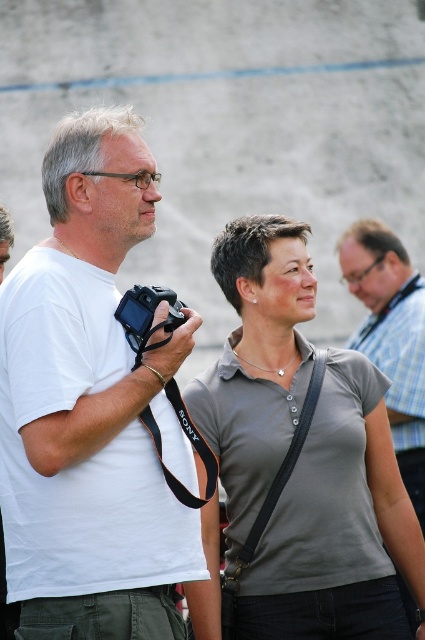
Is the position of plaid fabric shirt at center less distant than that of black plastic camera at left?

No, it is behind black plastic camera at left.

Can you confirm if plaid fabric shirt at center is positioned to the right of black plastic camera at left?

Yes, plaid fabric shirt at center is to the right of black plastic camera at left.

Identify the location of plaid fabric shirt at center. (391, 337).

Does white matte camera at left have a greater width compared to plaid fabric shirt at center?

Yes, white matte camera at left is wider than plaid fabric shirt at center.

Can you confirm if white matte camera at left is positioned below plaid fabric shirt at center?

Incorrect, white matte camera at left is not positioned below plaid fabric shirt at center.

Locate an element on the screen. This screenshot has height=640, width=425. white matte camera at left is located at coordinates (90, 408).

Consider the image. Who is shorter, white matte camera at left or black plastic camera at left?

black plastic camera at left

Between point (65, 433) and point (164, 339), which one is positioned behind?

Positioned behind is point (164, 339).

Does point (70, 177) lie in front of point (167, 314)?

No, it is behind (167, 314).

Image resolution: width=425 pixels, height=640 pixels. What are the coordinates of `white matte camera at left` in the screenshot? It's located at (90, 408).